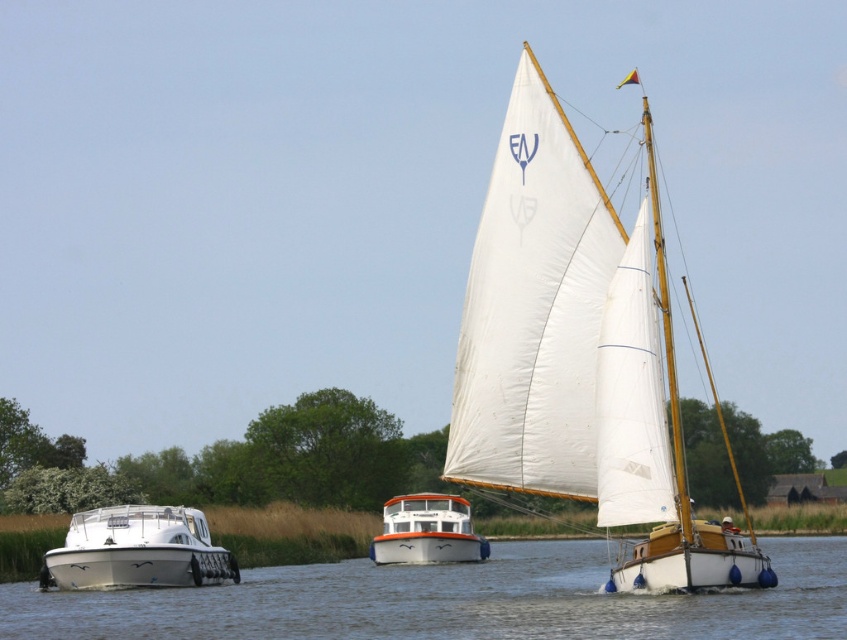
Based on the photo, between white smooth water at lower center and white glossy motorboat at lower left, which one is positioned higher?

white glossy motorboat at lower left is above.

Can you confirm if white smooth water at lower center is bigger than white glossy motorboat at lower left?

Yes, white smooth water at lower center is bigger than white glossy motorboat at lower left.

Measure the distance between white smooth water at lower center and camera.

28.69 meters

Where is `white smooth water at lower center`? This screenshot has height=640, width=847. white smooth water at lower center is located at coordinates (451, 600).

The image size is (847, 640). What do you see at coordinates (574, 355) in the screenshot?
I see `white canvas sailboat at center` at bounding box center [574, 355].

Is white canvas sailboat at center shorter than white smooth water at lower center?

No.

Image resolution: width=847 pixels, height=640 pixels. What do you see at coordinates (574, 355) in the screenshot? I see `white canvas sailboat at center` at bounding box center [574, 355].

Where is `white canvas sailboat at center`? This screenshot has width=847, height=640. white canvas sailboat at center is located at coordinates pyautogui.click(x=574, y=355).

Is white smooth water at lower center bigger than white glossy boat at center?

Yes.

Describe the element at coordinates (451, 600) in the screenshot. I see `white smooth water at lower center` at that location.

Is point (773, 563) closer to camera compared to point (375, 538)?

Yes.

Where is `white smooth water at lower center`? The image size is (847, 640). white smooth water at lower center is located at coordinates (451, 600).